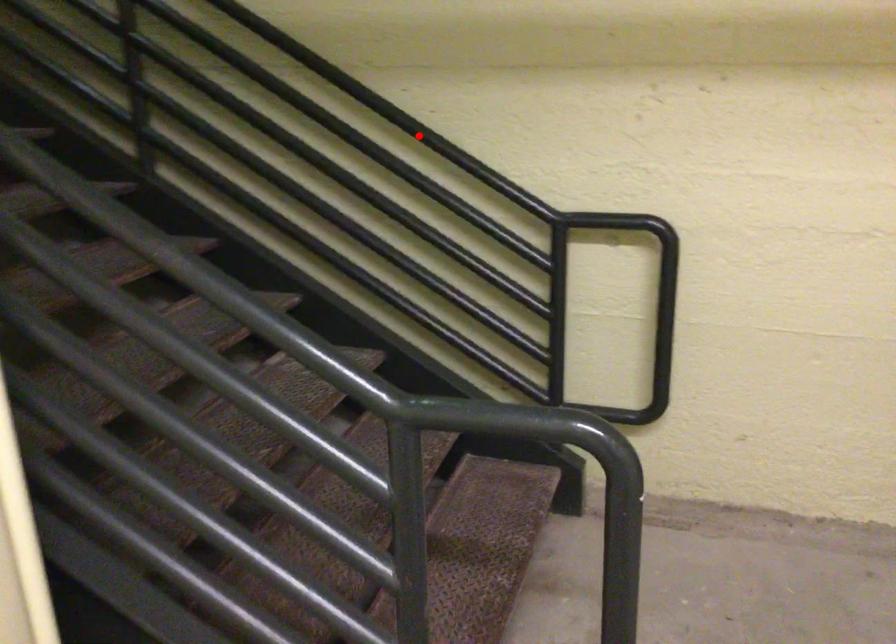
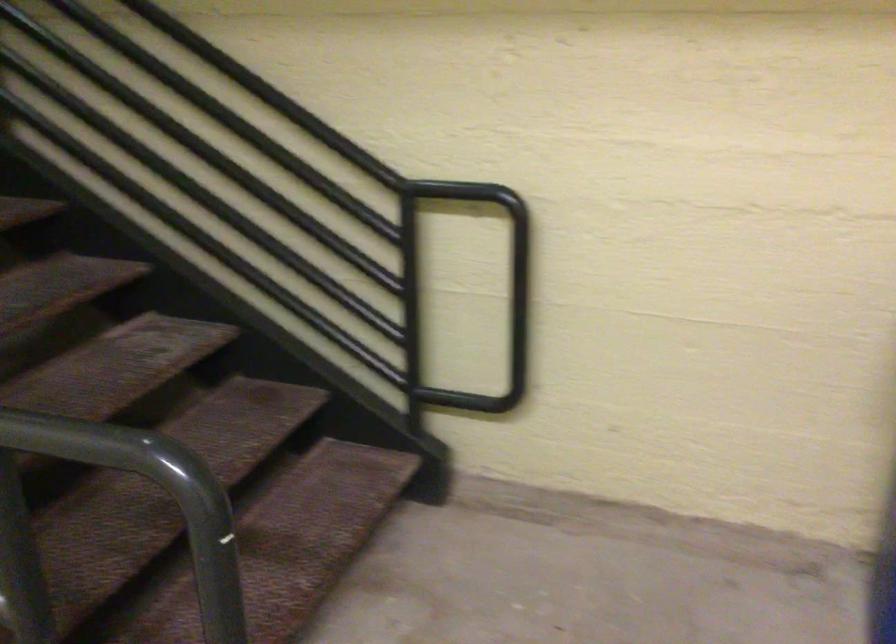
Locate, in the second image, the point that corresponds to the highlighted location in the first image.

(265, 91)